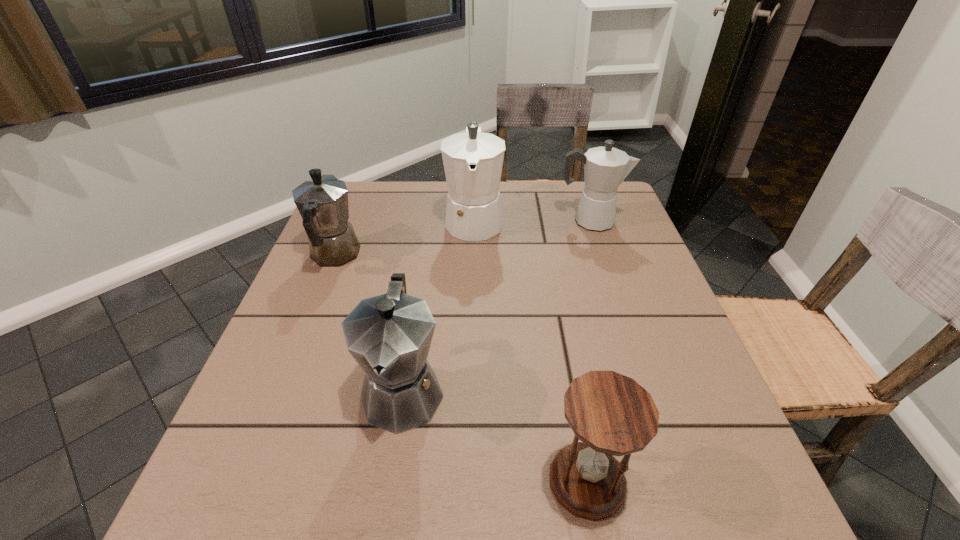
Image resolution: width=960 pixels, height=540 pixels. Find the location of `the tallest coffeepot`. the tallest coffeepot is located at coordinates pyautogui.click(x=473, y=161).

I want to click on the rightmost coffeepot, so click(x=605, y=168).

You are a GUI agent. You are given a task and a screenshot of the screen. Output one action in this format:
    pyautogui.click(x=<x>, y=<y>)
    Task: Click on the nearest coffeepot
    
    Given the screenshot: What is the action you would take?
    pyautogui.click(x=389, y=336)

Locate an element on the screen. the leftmost object is located at coordinates (322, 202).

Identify the location of the shortest object. (611, 414).

Identify the location of hourglass. Image resolution: width=960 pixels, height=540 pixels. (611, 414).

This screenshot has width=960, height=540. I want to click on vacant space located at the spout of the tallest coffeepot, so click(x=471, y=365).

This screenshot has height=540, width=960. In order to click on vacant space located on the left of the rightmost coffeepot in this screenshot , I will do `click(518, 221)`.

Locate an element on the screen. Image resolution: width=960 pixels, height=540 pixels. vacant point located 0.120m at the spout of the nearest coffeepot is located at coordinates (382, 525).

The width and height of the screenshot is (960, 540). I want to click on free space located 0.050m on the pouring side of the leftmost object, so click(348, 221).